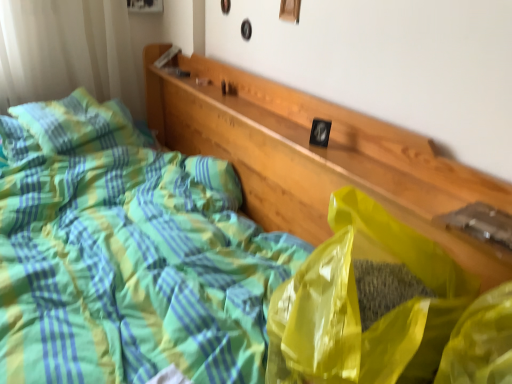
Question: Is yellow translucent plastic bag at center wider or thinner than green plaid pillow at upper left?

Choices:
 (A) thin
 (B) wide

Answer: (A)

Question: From their relative heights in the image, would you say yellow translucent plastic bag at center is taller or shorter than green plaid pillow at upper left?

Choices:
 (A) short
 (B) tall

Answer: (B)

Question: From a real-world perspective, is yellow translucent plastic bag at center above or below green plaid pillow at upper left?

Choices:
 (A) below
 (B) above

Answer: (B)

Question: From their relative heights in the image, would you say green plaid pillow at upper left is taller or shorter than yellow translucent plastic bag at center?

Choices:
 (A) tall
 (B) short

Answer: (B)

Question: From the image's perspective, is green plaid pillow at upper left located above or below yellow translucent plastic bag at center?

Choices:
 (A) above
 (B) below

Answer: (A)

Question: From a real-world perspective, is green plaid pillow at upper left above or below yellow translucent plastic bag at center?

Choices:
 (A) below
 (B) above

Answer: (A)

Question: Which is correct: green plaid pillow at upper left is inside yellow translucent plastic bag at center, or outside of it?

Choices:
 (A) outside
 (B) inside

Answer: (A)